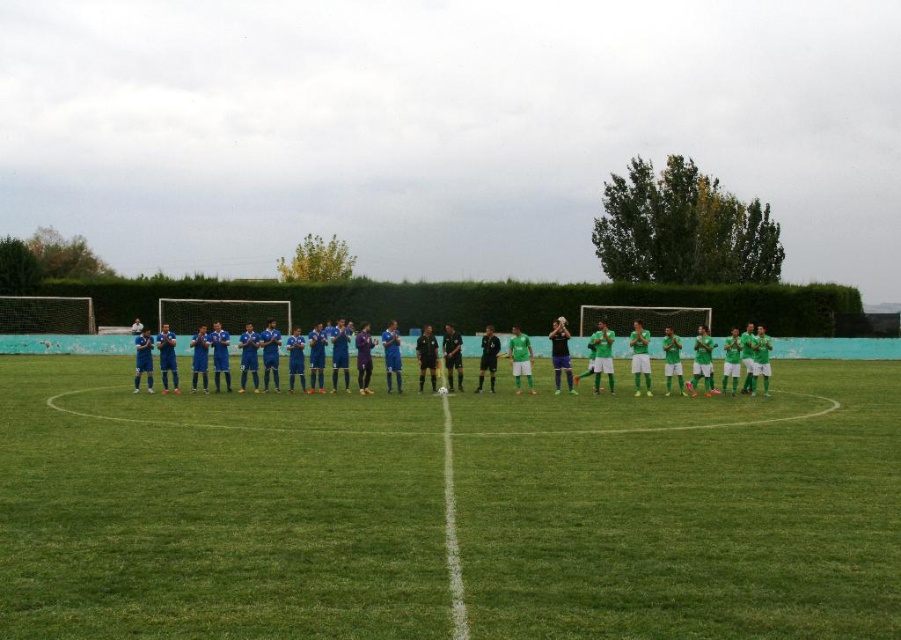
You are a soccer coach standing on the green grass football field at center. You want to give instructions to the blue matte soccer team at center. Can you shout to them without needing to use a microphone?

The distance between the green grass football field at center and the blue matte soccer team at center is 8.11 meters. Since this distance is within the typical shouting range of a human voice, you can likely communicate with the team without needing a microphone.

Based on the scene description, where is the green grass football field at center located in the image?

The green grass football field at center is located at point (215, 512).

You are a soccer coach observing the field. Which occupies more space in the image, the green grass football field at center or the blue matte soccer team at center?

The blue matte soccer team at center occupies more space than the green grass football field at center according to the description.